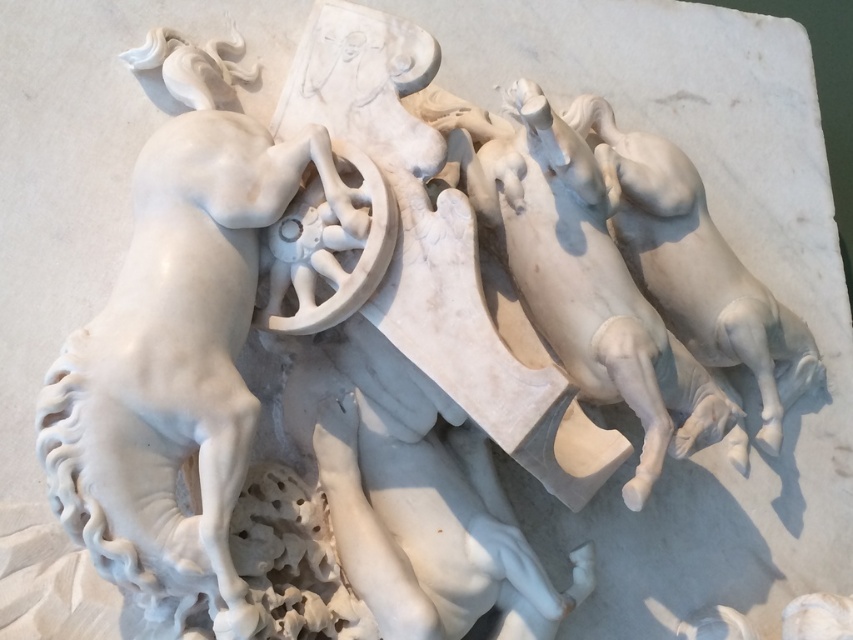
You are an art conservator examining the marble relief sculpture. You notice two groups of horses in the scene. The first group consists of the white marble horses at center, and the second is the white marble horse at right. Based on the sculpture, which group of horses is taller?

The white marble horses at center are taller than the white marble horse at right.

You are an art conservator examining the marble relief sculpture. You notice the white marble horse at left and the white marble horses at center. Which group is positioned closer to you?

The white marble horse at left is closer to the viewer than the white marble horses at center.